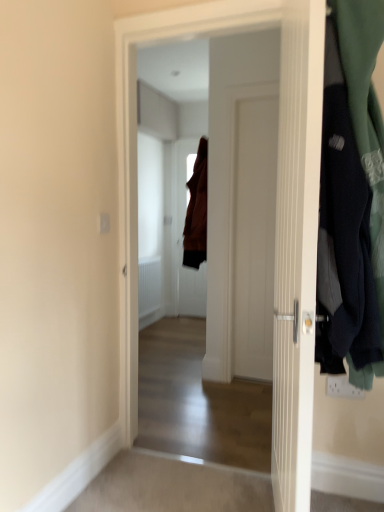
Locate an element on the screen. Image resolution: width=384 pixels, height=512 pixels. brown fabric door at center, which ranks as the first door in back-to-front order is located at coordinates (186, 237).

The height and width of the screenshot is (512, 384). Describe the element at coordinates (276, 210) in the screenshot. I see `white wooden door at center, the 2th door positioned from the back` at that location.

Where is `white wooden door at center, arranged as the second door when viewed from the front`? This screenshot has width=384, height=512. white wooden door at center, arranged as the second door when viewed from the front is located at coordinates (276, 210).

Where is `dark blue fabric at right`? dark blue fabric at right is located at coordinates (353, 190).

Where is `white wooden door at center, which appears as the 3th door when viewed from the back`? white wooden door at center, which appears as the 3th door when viewed from the back is located at coordinates (296, 249).

Do you think white wooden door at center, which appears as the 3th door when viewed from the back, is within brown fabric door at center, which ranks as the first door in back-to-front order, or outside of it?

white wooden door at center, which appears as the 3th door when viewed from the back, cannot be found inside brown fabric door at center, which ranks as the first door in back-to-front order.

Is white wooden door at center, which appears as the 3th door when viewed from the back, touching brown fabric door at center, which ranks as the first door in back-to-front order?

No, white wooden door at center, which appears as the 3th door when viewed from the back, is not beside brown fabric door at center, which ranks as the first door in back-to-front order.

Looking at this image, who is more distant, white wooden door at center, which appears as the 3th door when viewed from the back, or brown fabric door at center, which ranks as the first door in back-to-front order?

brown fabric door at center, which ranks as the first door in back-to-front order, is more distant.

How different are the orientations of white wooden door at center, acting as the 1th door starting from the front, and brown fabric door at center, which appears as the 3th door when viewed from the front, in degrees?

The angle between the facing direction of white wooden door at center, acting as the 1th door starting from the front, and the facing direction of brown fabric door at center, which appears as the 3th door when viewed from the front, is 78.1 degrees.

From the image's perspective, which is below, dark blue fabric at right or white wooden door at center, acting as the 1th door starting from the front?

white wooden door at center, acting as the 1th door starting from the front, from the image's perspective.

Is dark blue fabric at right aimed at white wooden door at center, which appears as the 3th door when viewed from the back?

Yes, dark blue fabric at right is facing white wooden door at center, which appears as the 3th door when viewed from the back.

From the picture: Which object is wider, dark blue fabric at right or white wooden door at center, which appears as the 3th door when viewed from the back?

dark blue fabric at right.

Which object is further away from the camera taking this photo, dark blue fabric at right or white wooden door at center, which appears as the 3th door when viewed from the back?

white wooden door at center, which appears as the 3th door when viewed from the back.

Can you confirm if brown fabric door at center, which ranks as the first door in back-to-front order, is smaller than white wooden door at center, which appears as the 3th door when viewed from the back?

Correct, brown fabric door at center, which ranks as the first door in back-to-front order, occupies less space than white wooden door at center, which appears as the 3th door when viewed from the back.

How much distance is there between brown fabric door at center, which ranks as the first door in back-to-front order, and white wooden door at center, which appears as the 3th door when viewed from the back?

They are 3.35 meters apart.

Is point (185, 266) positioned after point (277, 289)?

Yes, point (185, 266) is farther from viewer.

From a real-world perspective, is brown fabric door at center, which appears as the 3th door when viewed from the front, located higher than white wooden door at center, which appears as the 3th door when viewed from the back?

Correct, in the physical world, brown fabric door at center, which appears as the 3th door when viewed from the front, is higher than white wooden door at center, which appears as the 3th door when viewed from the back.

Can you tell me how much white wooden door at center, which appears as the 3th door when viewed from the back, and dark blue fabric at right differ in facing direction?

176 degrees separate the facing orientations of white wooden door at center, which appears as the 3th door when viewed from the back, and dark blue fabric at right.

Who is shorter, white wooden door at center, which appears as the 3th door when viewed from the back, or dark blue fabric at right?

Standing shorter between the two is dark blue fabric at right.

Is dark blue fabric at right located within white wooden door at center, acting as the 1th door starting from the front?

No, dark blue fabric at right is not inside white wooden door at center, acting as the 1th door starting from the front.

Does point (279, 109) appear closer or farther from the camera than point (352, 168)?

Point (279, 109).

Measure the distance between white wooden door at center, arranged as the second door when viewed from the front, and brown fabric door at center, which appears as the 3th door when viewed from the front.

2.93 meters.

Is white wooden door at center, arranged as the second door when viewed from the front, bigger or smaller than brown fabric door at center, which appears as the 3th door when viewed from the front?

In the image, white wooden door at center, arranged as the second door when viewed from the front, appears to be larger than brown fabric door at center, which appears as the 3th door when viewed from the front.

From the image's perspective, which one is positioned higher, white wooden door at center, arranged as the second door when viewed from the front, or brown fabric door at center, which appears as the 3th door when viewed from the front?

brown fabric door at center, which appears as the 3th door when viewed from the front, appears higher in the image.

Considering the positions of objects white wooden door at center, arranged as the second door when viewed from the front, and white wooden door at center, acting as the 1th door starting from the front, in the image provided, who is behind, white wooden door at center, arranged as the second door when viewed from the front, or white wooden door at center, acting as the 1th door starting from the front,?

white wooden door at center, arranged as the second door when viewed from the front, is behind.

Can you confirm if white wooden door at center, arranged as the second door when viewed from the front, is positioned to the right of white wooden door at center, which appears as the 3th door when viewed from the back?

No, white wooden door at center, arranged as the second door when viewed from the front, is not to the right of white wooden door at center, which appears as the 3th door when viewed from the back.

Is there a large distance between white wooden door at center, the 2th door positioned from the back, and white wooden door at center, acting as the 1th door starting from the front?

white wooden door at center, the 2th door positioned from the back, is near white wooden door at center, acting as the 1th door starting from the front, not far away.

Can you confirm if white wooden door at center, the 2th door positioned from the back, is shorter than white wooden door at center, acting as the 1th door starting from the front?

In fact, white wooden door at center, the 2th door positioned from the back, may be taller than white wooden door at center, acting as the 1th door starting from the front.

Based on the photo, is brown fabric door at center, which appears as the 3th door when viewed from the front, to the left or to the right of dark blue fabric at right in the image?

Result: brown fabric door at center, which appears as the 3th door when viewed from the front, is positioned on dark blue fabric at right's left side.

Is dark blue fabric at right inside brown fabric door at center, which ranks as the first door in back-to-front order?

Actually, dark blue fabric at right is outside brown fabric door at center, which ranks as the first door in back-to-front order.

Who is more distant, brown fabric door at center, which appears as the 3th door when viewed from the front, or dark blue fabric at right?

brown fabric door at center, which appears as the 3th door when viewed from the front, is further from the camera.

Is there a large distance between brown fabric door at center, which ranks as the first door in back-to-front order, and dark blue fabric at right?

That's right, there is a large distance between brown fabric door at center, which ranks as the first door in back-to-front order, and dark blue fabric at right.

In order to click on door located underneath the brown fabric door at center, which appears as the 3th door when viewed from the front (from a real-world perspective) in this screenshot , I will do `click(296, 249)`.

Where is `closet that is in front of the white wooden door at center, which appears as the 3th door when viewed from the back`? This screenshot has width=384, height=512. closet that is in front of the white wooden door at center, which appears as the 3th door when viewed from the back is located at coordinates (353, 190).

From the image, which object appears to be nearer to brown fabric door at center, which ranks as the first door in back-to-front order, dark blue fabric at right or white wooden door at center, which appears as the 3th door when viewed from the back?

white wooden door at center, which appears as the 3th door when viewed from the back.

Estimate the real-world distances between objects in this image. Which object is further from dark blue fabric at right, white wooden door at center, which appears as the 3th door when viewed from the back, or brown fabric door at center, which ranks as the first door in back-to-front order?

brown fabric door at center, which ranks as the first door in back-to-front order, is further to dark blue fabric at right.

When comparing their distances from brown fabric door at center, which ranks as the first door in back-to-front order, does white wooden door at center, the 2th door positioned from the back, or dark blue fabric at right seem closer?

white wooden door at center, the 2th door positioned from the back.

Based on their spatial positions, is brown fabric door at center, which appears as the 3th door when viewed from the front, or white wooden door at center, the 2th door positioned from the back, further from dark blue fabric at right?

brown fabric door at center, which appears as the 3th door when viewed from the front, lies further to dark blue fabric at right than the other object.

Estimate the real-world distances between objects in this image. Which object is closer to white wooden door at center, the 2th door positioned from the back, white wooden door at center, acting as the 1th door starting from the front, or brown fabric door at center, which ranks as the first door in back-to-front order?

Among the two, white wooden door at center, acting as the 1th door starting from the front, is located nearer to white wooden door at center, the 2th door positioned from the back.

From the image, which object appears to be nearer to brown fabric door at center, which appears as the 3th door when viewed from the front, dark blue fabric at right or white wooden door at center, arranged as the second door when viewed from the front?

white wooden door at center, arranged as the second door when viewed from the front, lies closer to brown fabric door at center, which appears as the 3th door when viewed from the front, than the other object.

Which object lies further to the anchor point dark blue fabric at right, brown fabric door at center, which ranks as the first door in back-to-front order, or white wooden door at center, which appears as the 3th door when viewed from the back?

brown fabric door at center, which ranks as the first door in back-to-front order, is further to dark blue fabric at right.

Based on their spatial positions, is dark blue fabric at right or brown fabric door at center, which appears as the 3th door when viewed from the front, closer to white wooden door at center, acting as the 1th door starting from the front?

dark blue fabric at right lies closer to white wooden door at center, acting as the 1th door starting from the front, than the other object.

Locate an element on the screen. The height and width of the screenshot is (512, 384). door positioned between white wooden door at center, acting as the 1th door starting from the front, and brown fabric door at center, which ranks as the first door in back-to-front order, from near to far is located at coordinates (276, 210).

Where is `door between dark blue fabric at right and white wooden door at center, arranged as the second door when viewed from the front, along the z-axis`? The width and height of the screenshot is (384, 512). door between dark blue fabric at right and white wooden door at center, arranged as the second door when viewed from the front, along the z-axis is located at coordinates (296, 249).